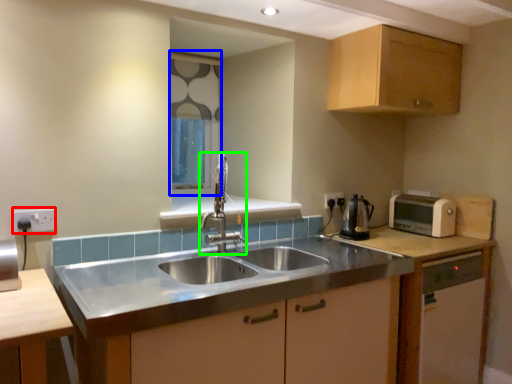
Question: Which object is the closest to the electric outlet (highlighted by a red box)? Choose among these: window screen (highlighted by a blue box) or tap (highlighted by a green box).

Choices:
 (A) window screen
 (B) tap

Answer: (B)